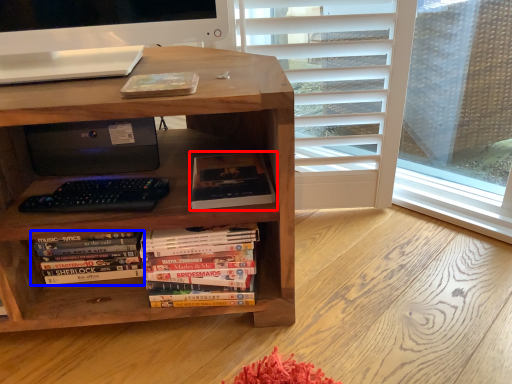
Question: Which point is closer to the camera, book (highlighted by a red box) or book (highlighted by a blue box)?

Choices:
 (A) book
 (B) book

Answer: (A)